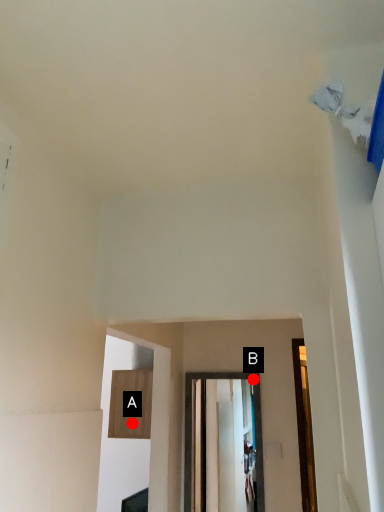
Question: Two points are circled on the image, labeled by A and B beside each circle. Which point appears farthest from the camera in this image?

Choices:
 (A) A is further
 (B) B is further

Answer: (A)